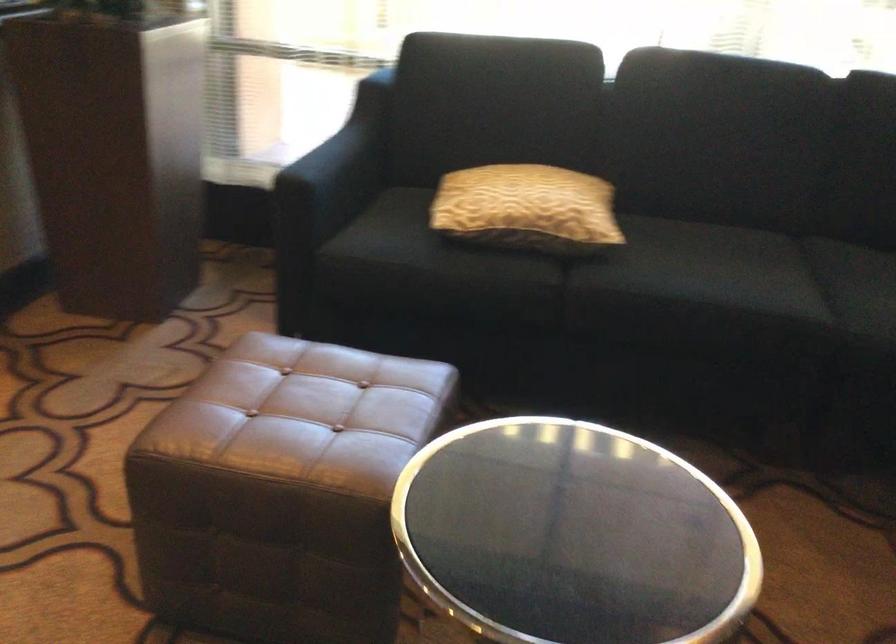
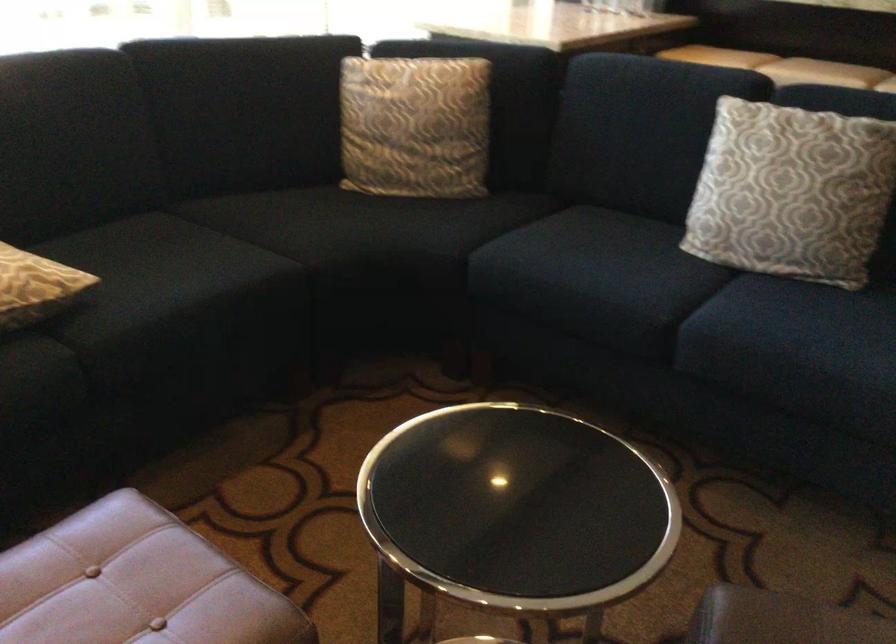
In the second image, find the point that corresponds to (x=520, y=520) in the first image.

(517, 507)